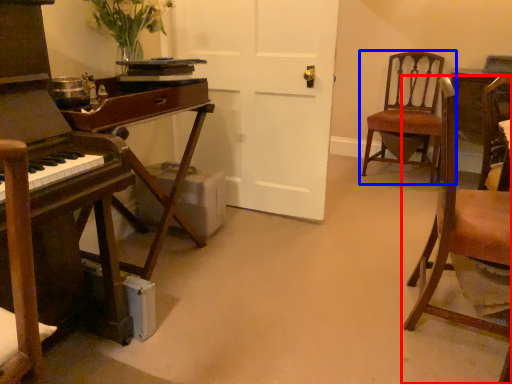
Question: Which object appears closest to the camera in this image, chair (highlighted by a red box) or chair (highlighted by a blue box)?

Choices:
 (A) chair
 (B) chair

Answer: (A)